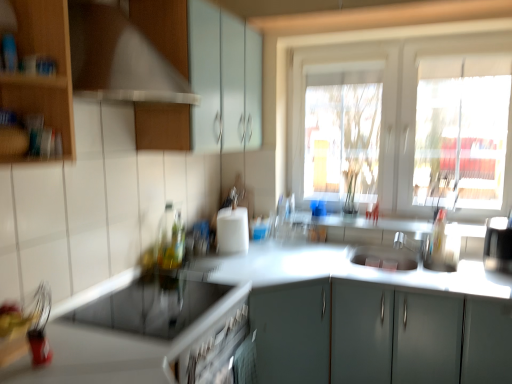
Find the location of `vacant region to the left of sleek silver coffee machine at right`. vacant region to the left of sleek silver coffee machine at right is located at coordinates 472,268.